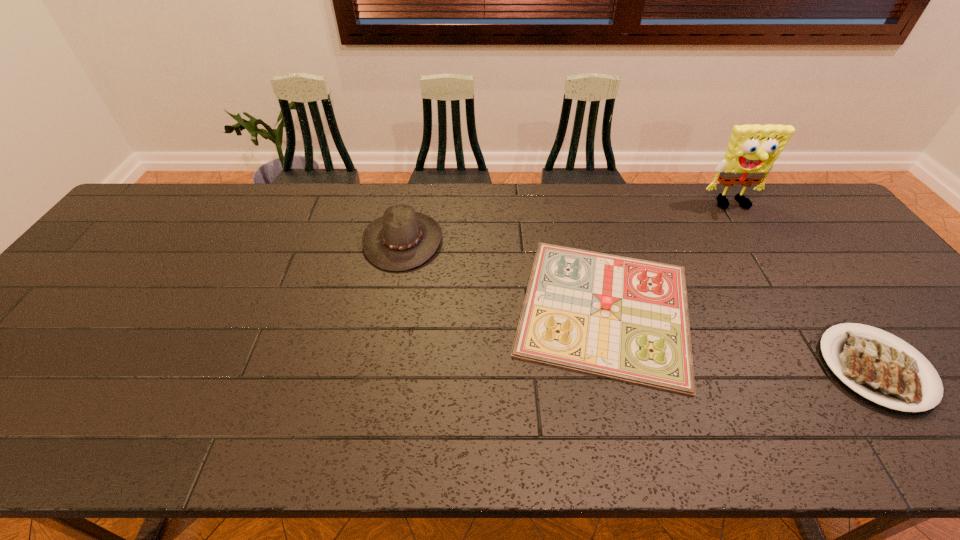
Locate an element on the screen. vacant space at the far edge is located at coordinates (375, 197).

Where is `vacant area at the near edge`? The image size is (960, 540). vacant area at the near edge is located at coordinates (615, 435).

This screenshot has width=960, height=540. What are the coordinates of `free space at the left edge of the desktop` in the screenshot? It's located at (19, 387).

Locate an element on the screen. This screenshot has height=540, width=960. free point at the right edge is located at coordinates (864, 265).

The height and width of the screenshot is (540, 960). In the image, there is a desktop. In order to click on vacant space at the far right corner in this screenshot , I will do `click(774, 200)`.

Find the location of a particular element. This screenshot has width=960, height=540. free space at the near right corner is located at coordinates (955, 421).

This screenshot has height=540, width=960. Identify the location of unoccupied position between the third tallest object and the hat. (504, 274).

You are a GUI agent. You are given a task and a screenshot of the screen. Output one action in this format:
    pyautogui.click(x=<x>, y=<y>)
    Task: Click on the blank region between the gameboard and the tallest object
    
    Given the screenshot: What is the action you would take?
    pyautogui.click(x=669, y=257)

This screenshot has width=960, height=540. Identify the location of vacant area between the second shortest object and the sponge. pyautogui.click(x=669, y=257).

You are a GUI agent. You are given a task and a screenshot of the screen. Output one action in this format:
    pyautogui.click(x=<x>, y=<y>)
    Task: Click on the free space between the third tallest object and the hat
    
    Given the screenshot: What is the action you would take?
    pyautogui.click(x=504, y=274)